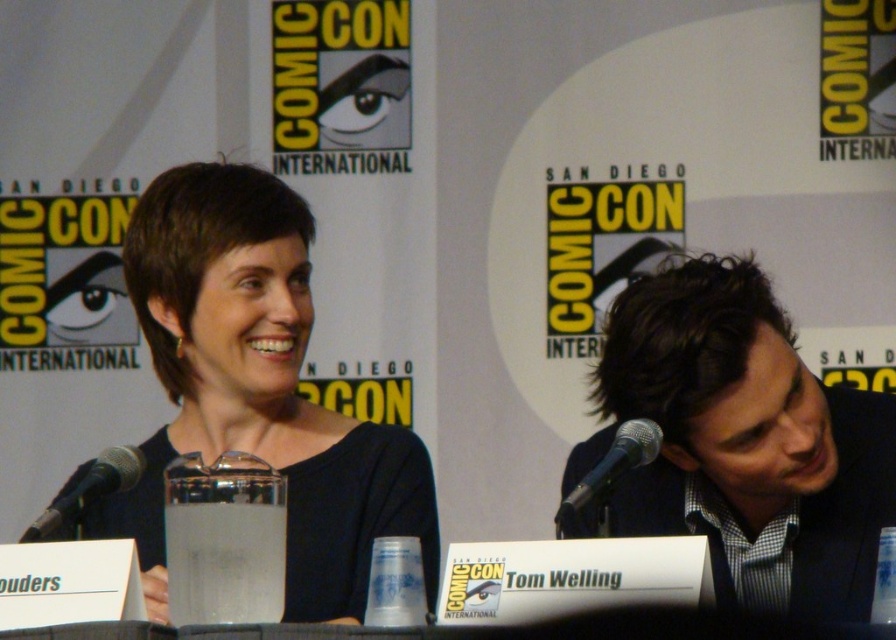
You are a photographer positioned at the camera. You need to capture a closeup shot of the black textured suit at right. Considering your current position, is the distance sufficient for a clear closeup without moving the camera?

The black textured suit at right is 2.45 meters away from the camera. A typical closeup shot requires a distance of about 1.5 to 2 meters. Since 2.45 meters exceeds this range, the photographer may need to move closer or use a zoom lens to achieve a clear closeup.

You are an event organizer at Comic Con and need to adjust the microphone height for the panelist in the black textured suit at right. Based on the image, will the black matte microphone at left reach up to their mouth level?

The black textured suit at right is much taller than the black matte microphone at left, so the microphone will not reach up to their mouth level and needs adjustment.